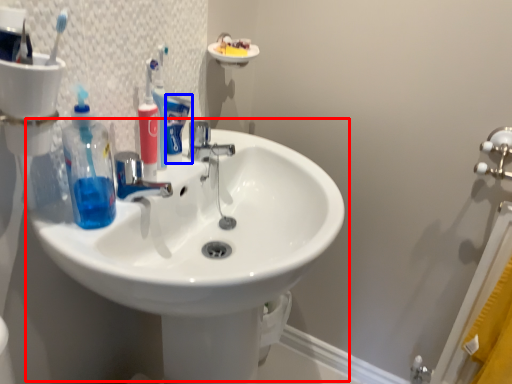
Question: Which point is closer to the camera, sink (highlighted by a red box) or toothpaste (highlighted by a blue box)?

Choices:
 (A) sink
 (B) toothpaste

Answer: (A)